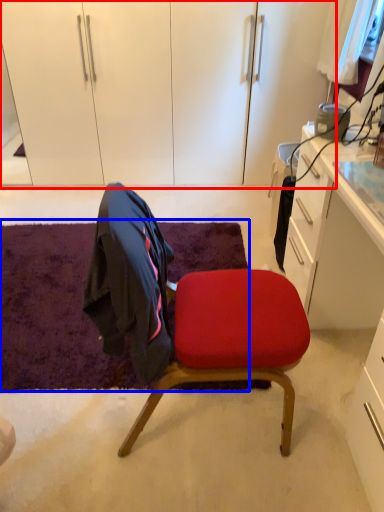
Question: Which of the following is the farthest to the observer, dresser (highlighted by a red box) or mat (highlighted by a blue box)?

Choices:
 (A) dresser
 (B) mat

Answer: (A)